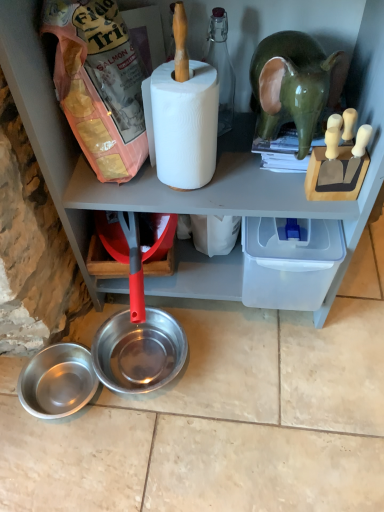
The image size is (384, 512). Identify the location of vacant space to the left of brushed metal bowl at lower left, which appears as the 2th bowl when viewed from the right. (15, 391).